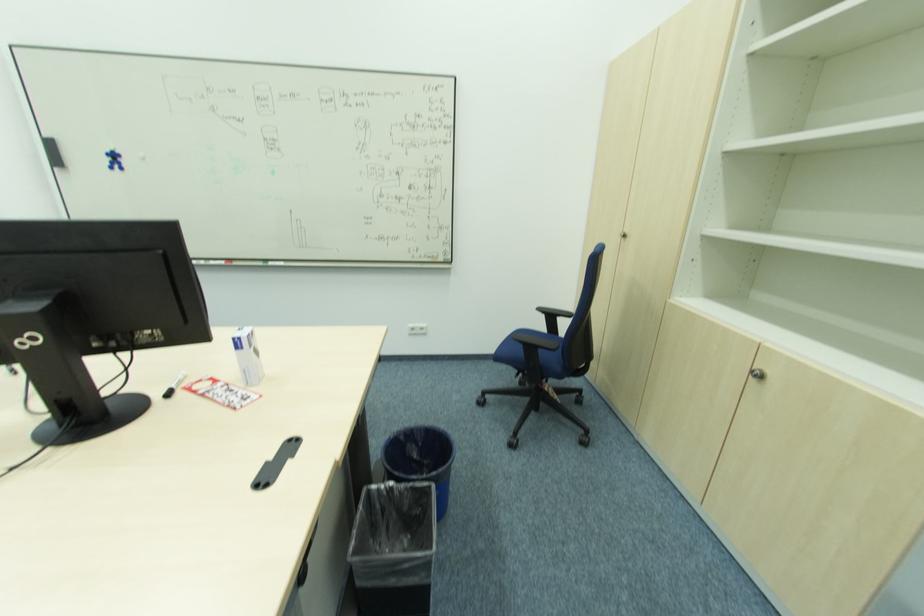
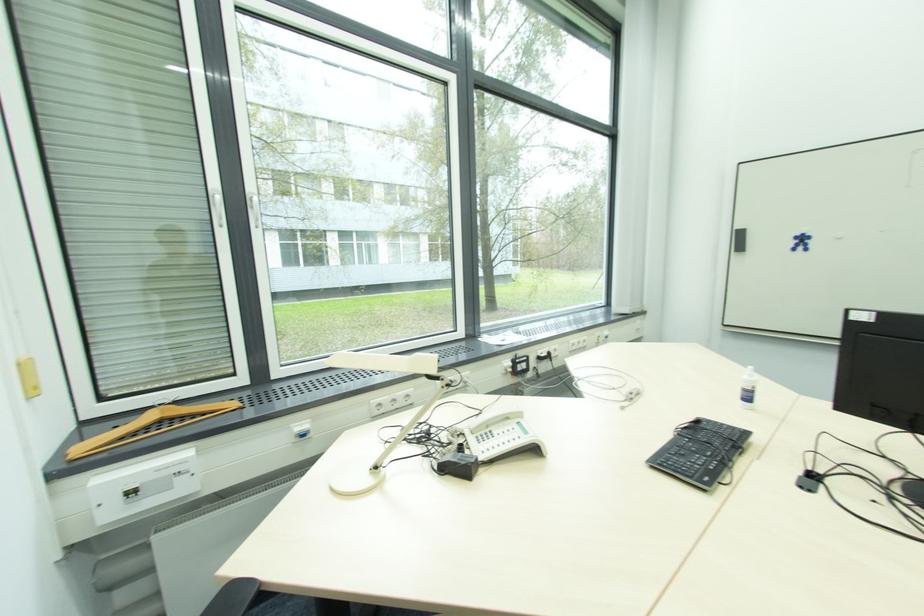
Where in the second image is the point corresponding to pixel 52 140 from the first image?

(739, 230)